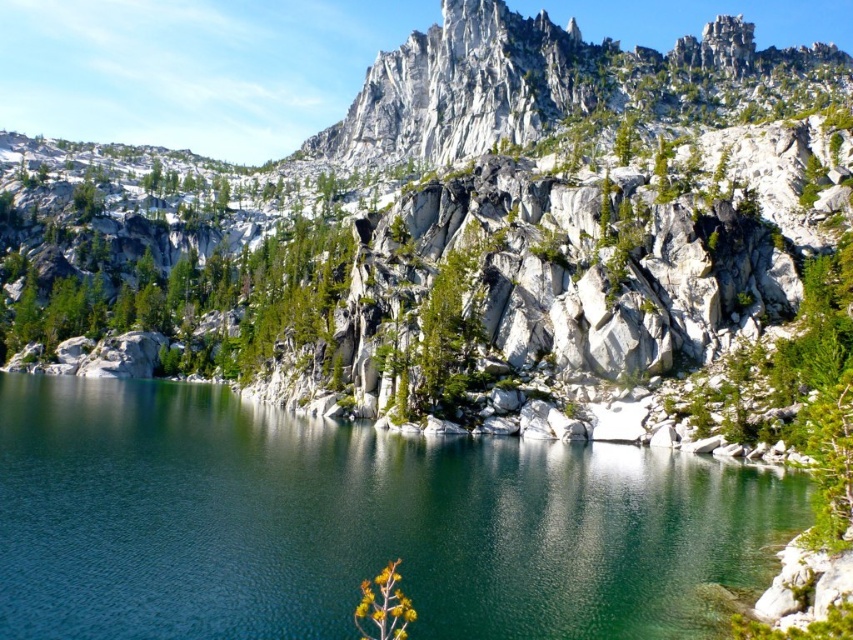
Question: Observing the image, what is the correct spatial positioning of green glossy water at center in reference to yellow-green leafy plant at lower center?

Choices:
 (A) right
 (B) left

Answer: (B)

Question: Which point is farther to the camera?

Choices:
 (A) (403, 637)
 (B) (131, 621)

Answer: (B)

Question: Which point is closer to the camera?

Choices:
 (A) (158, 428)
 (B) (409, 618)

Answer: (B)

Question: Considering the relative positions of green glossy water at center and yellow-green leafy plant at lower center in the image provided, where is green glossy water at center located with respect to yellow-green leafy plant at lower center?

Choices:
 (A) left
 (B) right

Answer: (A)

Question: Does white rock mountain at upper center have a larger size compared to green glossy water at center?

Choices:
 (A) no
 (B) yes

Answer: (B)

Question: Which is farther from the green glossy water at center?

Choices:
 (A) white rock mountain at upper center
 (B) yellow-green leafy plant at lower center

Answer: (A)